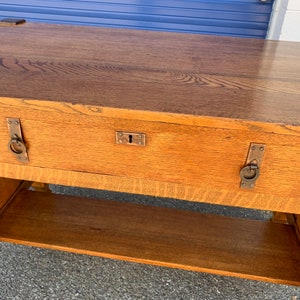
This screenshot has height=300, width=300. In order to click on nice floor, grey in this screenshot , I will do `click(116, 276)`.